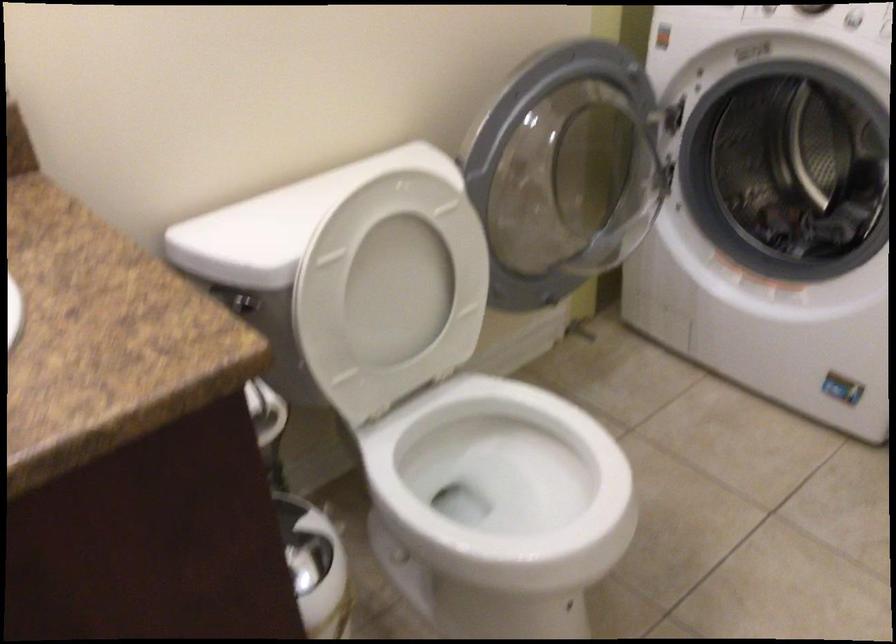
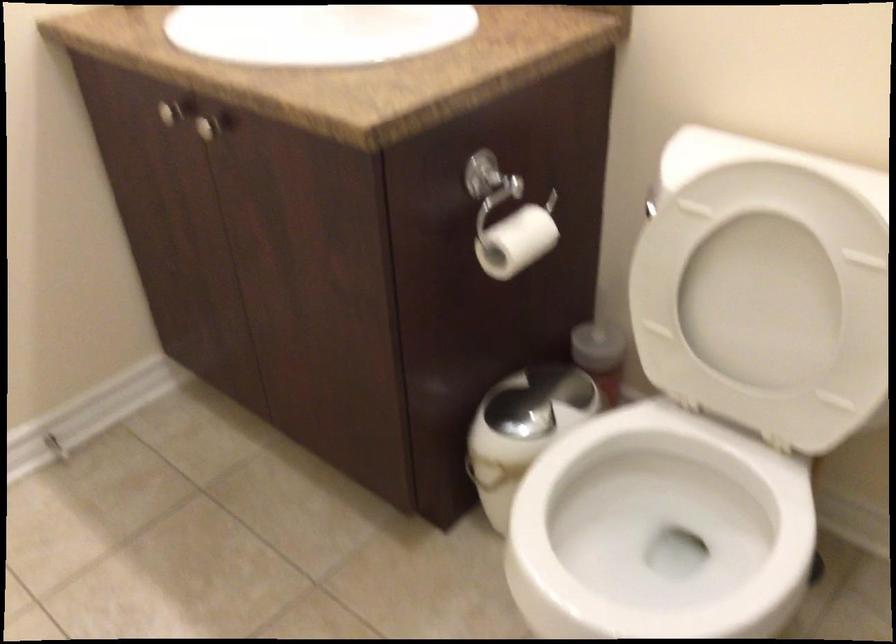
Find the pixel in the second image that matches pixel 256 399 in the first image.

(515, 242)